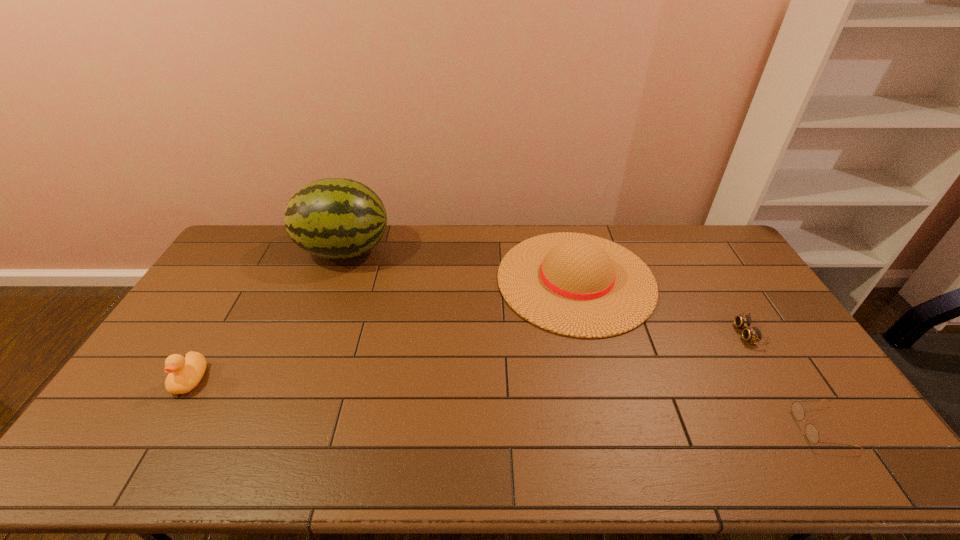
Find the location of a particular element. Image resolution: width=960 pixels, height=540 pixels. free region located 0.160m on the face of the duck is located at coordinates (145, 455).

At what (x,y) coordinates should I click in order to perform the action: click on free spot located through the lenses of the goggles. Please return your answer as a coordinate pair (x, y). The image size is (960, 540). Looking at the image, I should click on (647, 333).

Identify the location of vacant space situated through the lenses of the goggles. Image resolution: width=960 pixels, height=540 pixels. (660, 333).

Locate an element on the screen. free space located through the lenses of the goggles is located at coordinates (608, 333).

Locate an element on the screen. The width and height of the screenshot is (960, 540). vacant space located 0.130m on the temples of the spectacles is located at coordinates (747, 427).

You are a GUI agent. You are given a task and a screenshot of the screen. Output one action in this format:
    pyautogui.click(x=<x>, y=<y>)
    Task: Click on the vacant region located 0.070m on the temples of the spectacles
    Image resolution: width=960 pixels, height=540 pixels.
    Given the screenshot: What is the action you would take?
    pyautogui.click(x=771, y=427)

Identify the location of vacant position located on the temples of the spectacles. The image size is (960, 540). (743, 427).

Find the location of a particular element. watermelon that is at the far edge is located at coordinates (335, 218).

Identify the location of bonnet that is at the far edge. (578, 285).

Identify the location of object that is at the near edge. (811, 432).